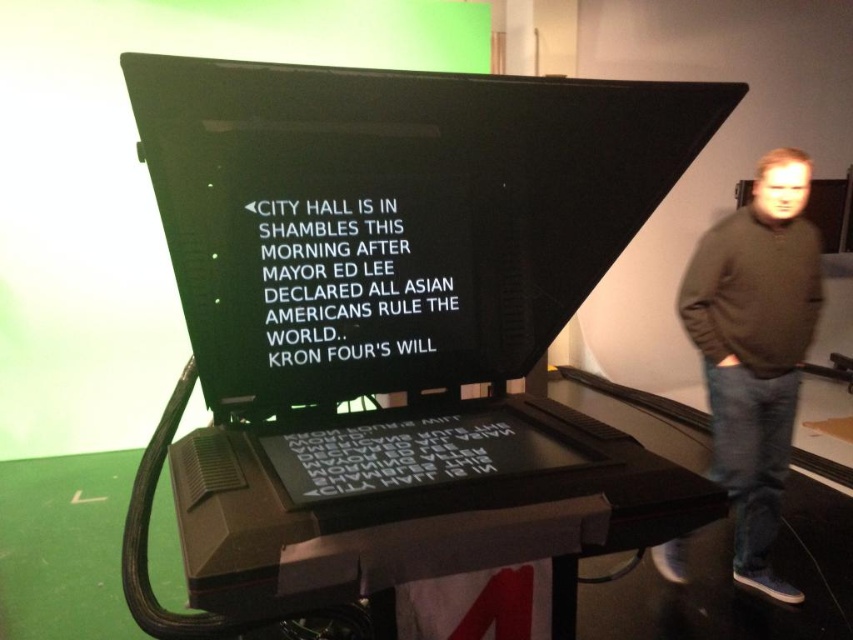
In the scene shown: You are setting up a display in a museum and need to arrange the black plastic computer screen at center and the brown sweater at right. Which object should you place first if you want to follow the rule of arranging larger items before smaller ones?

The brown sweater at right should be placed first because it is larger than the black plastic computer screen at center.

You are a person who is 5 feet tall. You want to place a 1 foot tall book on the desk so that it is between the black plastic computer screen at center and the brown sweater at right. Is this possible?

The black plastic computer screen at center is 6.22 feet away from the brown sweater at right. Since the book is only 1 foot tall, placing it between them would require the distance between the two objects to be at least 1 foot. Since 6.22 feet is greater than 1 foot, yes, you can place the book between the black plastic computer screen at center and the brown sweater at right.